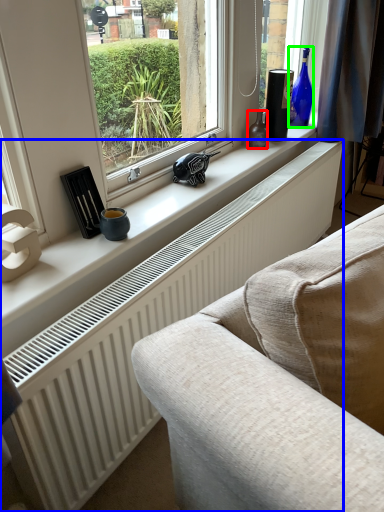
Question: Based on their relative distances, which object is farther from bottle (highlighted by a red box)? Choose from radiator (highlighted by a blue box) and bottle (highlighted by a green box).

Choices:
 (A) radiator
 (B) bottle

Answer: (A)